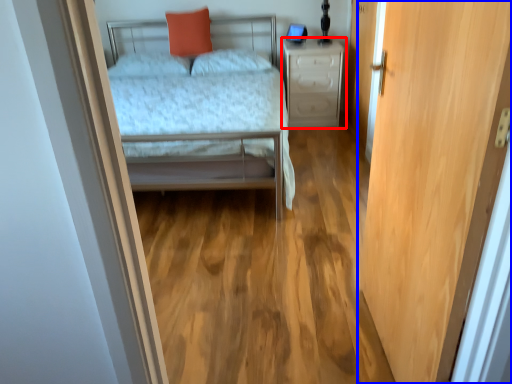
Question: Which of the following is the farthest to the observer, nightstand (highlighted by a red box) or door (highlighted by a blue box)?

Choices:
 (A) nightstand
 (B) door

Answer: (A)